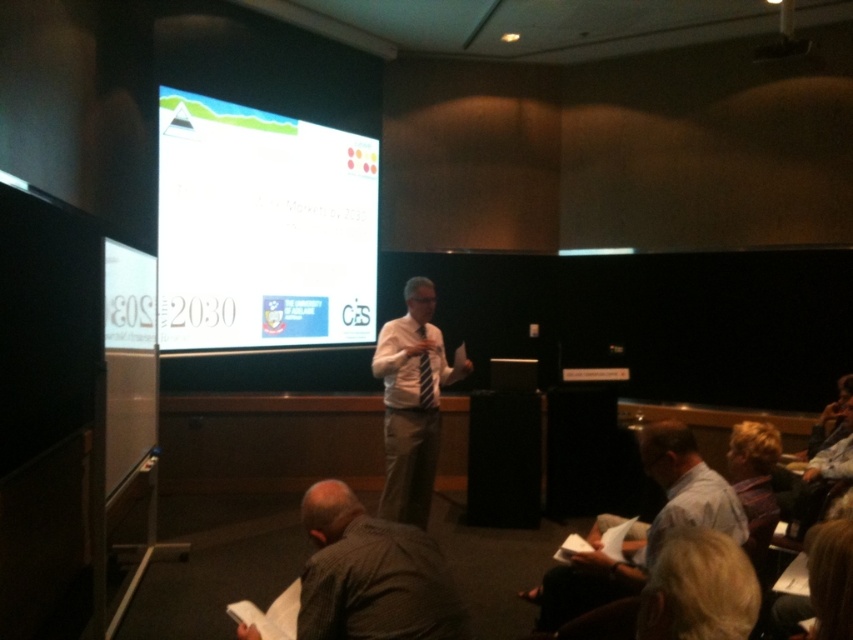
You are an attendee at the presentation and want to take a photo of the presenter and the projection screen. Since your phone camera has a limited field of view, will you be able to frame both the white glossy projection screen at upper center and the white shirt at center in a single shot?

The white glossy projection screen at upper center is larger than the white shirt at center. Since the screen is bigger, it might occupy most of the frame, but as long as the presenter is positioned near the screen, both should fit in the shot depending on your distance and angle.

You are sitting in the audience of this presentation and want to ask a question to the speaker. Which object is closer to you, the white shirt at center or the blonde hair at lower right?

The white shirt at center is closer to you because it is further to the viewer than the blonde hair at lower right, so it is nearer in proximity.

You are an attendee sitting in the back row of the conference room. You notice a point at coordinates (x=262, y=228) on the wall. What object is located at that point?

The point at coordinates (x=262, y=228) corresponds to the white glossy projection screen at upper center.